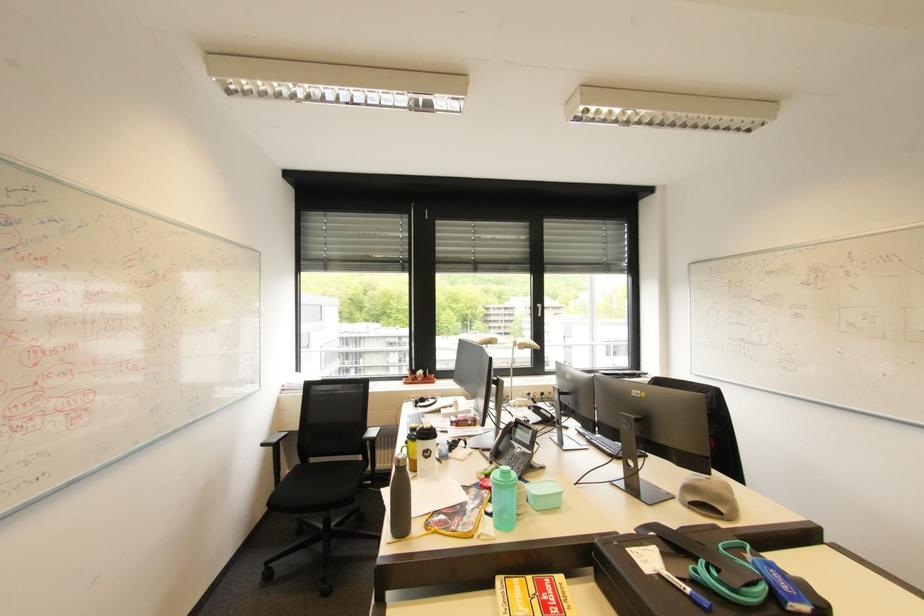
Identify the location of black chair armrest. (371, 434).